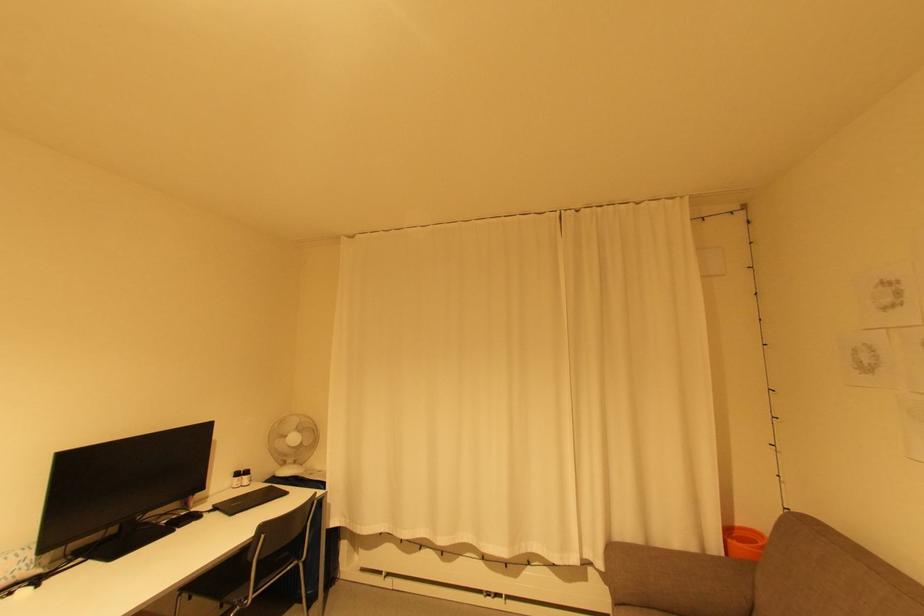
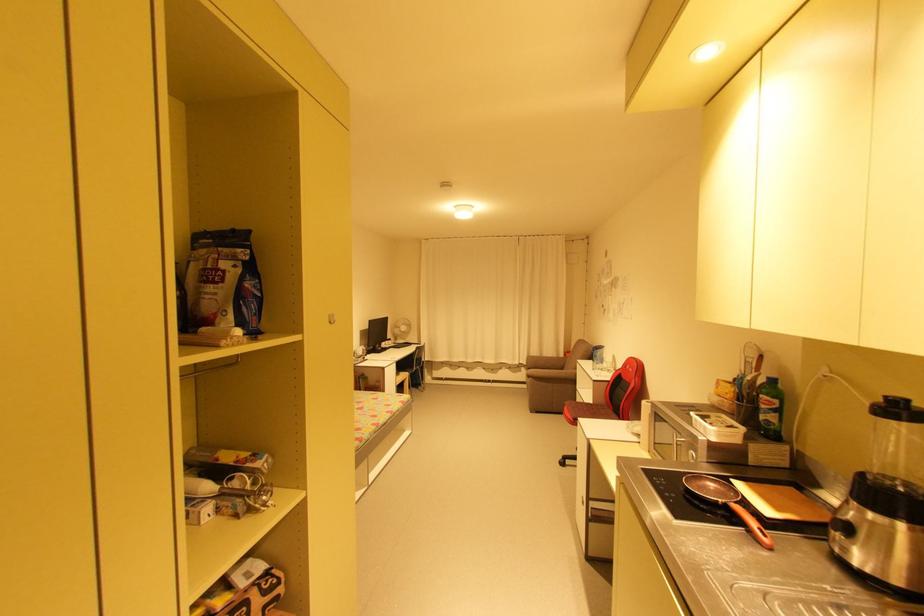
Where in the second image is the point corresponding to (250,477) from the first image?

(395, 342)